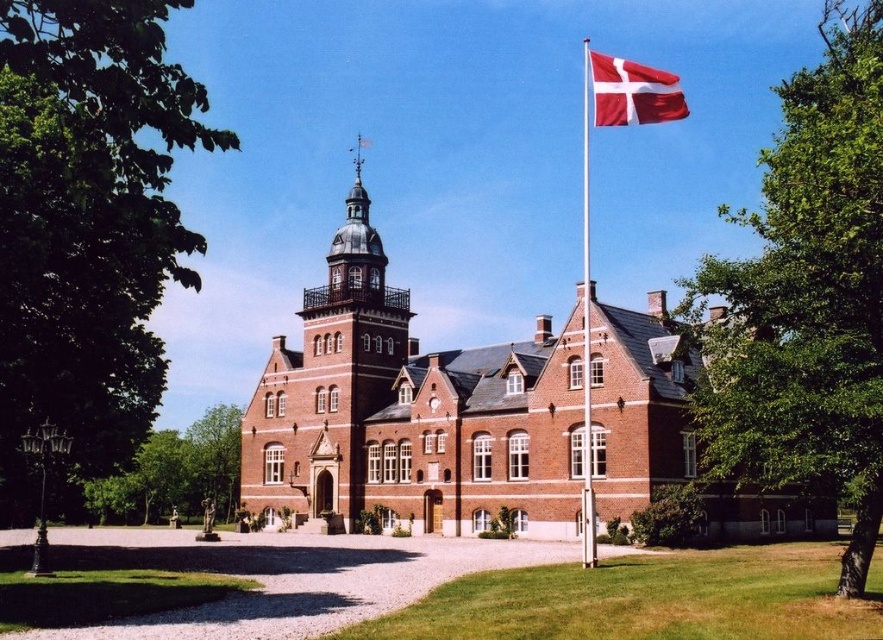
Question: Which point is closer to the camera taking this photo?

Choices:
 (A) (248, 412)
 (B) (585, 497)

Answer: (B)

Question: Which point is farther to the camera?

Choices:
 (A) (587, 374)
 (B) (640, 65)

Answer: (B)

Question: Does brick tower at center have a larger size compared to white metallic flag pole at upper right?

Choices:
 (A) yes
 (B) no

Answer: (B)

Question: Does brick tower at center have a lesser width compared to white metallic flag pole at upper right?

Choices:
 (A) yes
 (B) no

Answer: (B)

Question: Does brick tower at center lie in front of red fabric flag at upper right?

Choices:
 (A) yes
 (B) no

Answer: (B)

Question: Which object appears farthest from the camera in this image?

Choices:
 (A) white metallic flag pole at upper right
 (B) brick tower at center

Answer: (B)